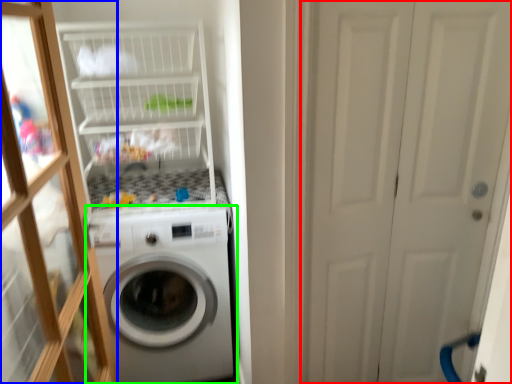
Question: Based on their relative distances, which object is nearer to screen door (highlighted by a red box)? Choose from glass door (highlighted by a blue box) and washing machine (highlighted by a green box).

Choices:
 (A) glass door
 (B) washing machine

Answer: (B)